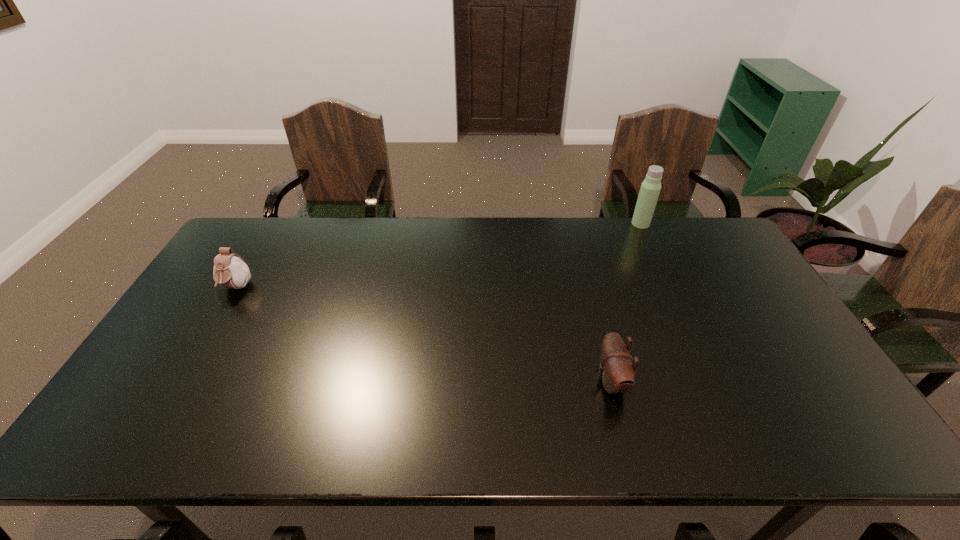
Find the location of a particular element. vacant position located with the flap open on the nearest object is located at coordinates (532, 381).

Identify the location of object present at the far edge. (650, 189).

This screenshot has height=540, width=960. I want to click on object positioned at the left edge, so click(x=230, y=270).

Where is `free space at the far edge`? The height and width of the screenshot is (540, 960). free space at the far edge is located at coordinates click(372, 220).

Locate an element on the screen. This screenshot has width=960, height=540. free space at the near edge is located at coordinates (765, 430).

In the image, there is a desktop. At what (x,y) coordinates should I click in order to perform the action: click on vacant space at the left edge. Please return your answer as a coordinate pair (x, y). Looking at the image, I should click on (196, 387).

Find the location of a particular element. free space at the far left corner of the desktop is located at coordinates (242, 251).

Identify the location of free region at the far right corner of the desktop. (703, 242).

The height and width of the screenshot is (540, 960). In order to click on vacant point located between the nearer pouch and the tallest object in this screenshot , I will do `click(626, 302)`.

Where is `free point between the right pouch and the rightmost object`? This screenshot has height=540, width=960. free point between the right pouch and the rightmost object is located at coordinates (626, 302).